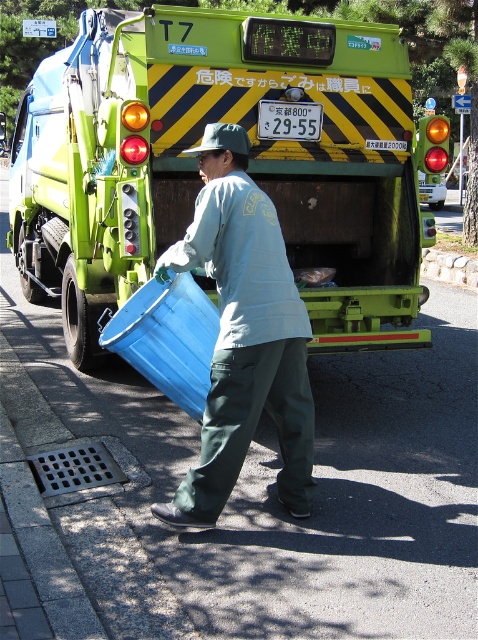
Question: Does green matte truck at center have a larger size compared to matte blue plastic bin at center?

Choices:
 (A) yes
 (B) no

Answer: (A)

Question: Considering the relative positions of green matte truck at center and matte blue plastic bin at center in the image provided, where is green matte truck at center located with respect to matte blue plastic bin at center?

Choices:
 (A) left
 (B) right

Answer: (B)

Question: Is green matte truck at center positioned at the back of matte blue plastic bin at center?

Choices:
 (A) no
 (B) yes

Answer: (B)

Question: Which object is farther from the camera taking this photo?

Choices:
 (A) green matte truck at center
 (B) matte blue plastic bin at center

Answer: (A)